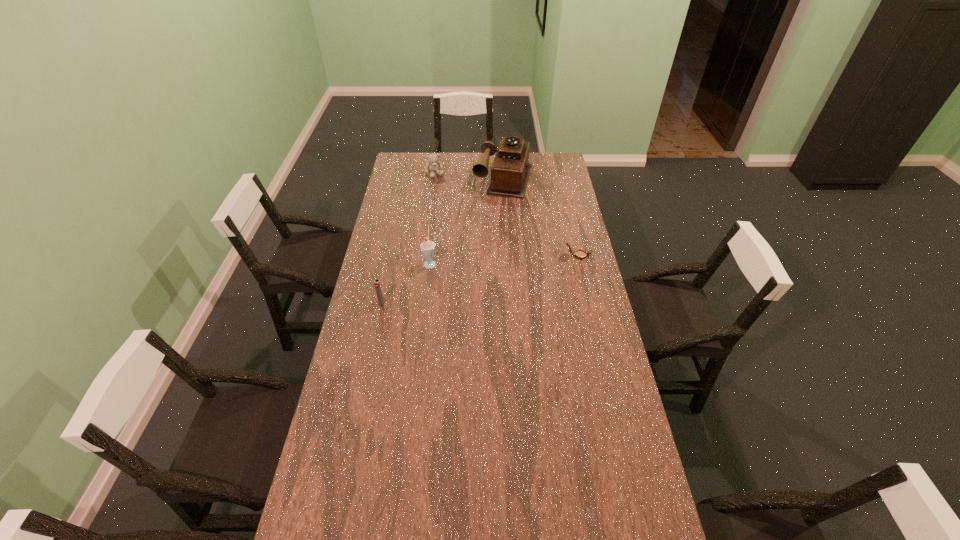
Find the location of `vacant space on the desktop that is between the nearest object and the rightmost object and is positioned on the straw side of the fourth shortest object`. vacant space on the desktop that is between the nearest object and the rightmost object and is positioned on the straw side of the fourth shortest object is located at coordinates (485, 278).

Locate an element on the screen. free space on the desktop that is between the nearest object and the compass and is positioned on the horn of the tallest object is located at coordinates (469, 282).

At what (x,y) coordinates should I click in order to perform the action: click on vacant space on the desktop that is between the leftmost object and the compass and is positioned on the face of the teddy bear. Please return your answer as a coordinate pair (x, y). Looking at the image, I should click on (492, 276).